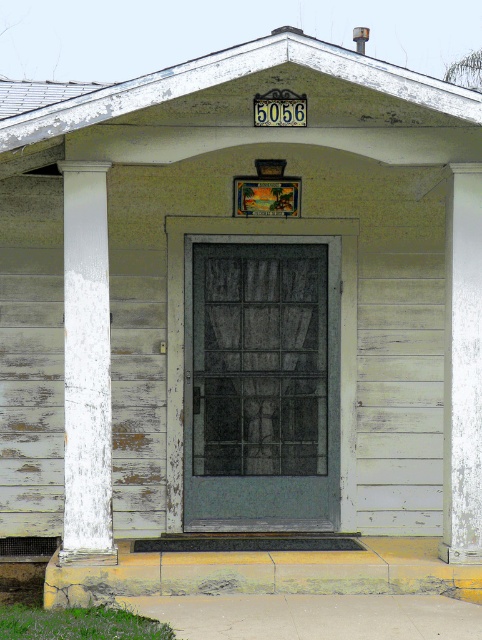
You are a painter hired to paint the columns and wood elements at the front of the house. You have a ladder that can reach up to 2 meters. The white painted wood column at left and white painted wood at center are both within your ladder reach. Which object requires more effort to paint due to its size?

The white painted wood column at left requires more effort to paint because its width is larger than the white painted wood at center.

You are standing at the front entrance of the house and want to know how far the point at coordinates (105, 193) is from your current position. Can you determine the distance?

The point at coordinates (105, 193) is 8.31 meters away from the camera, so it is 8.31 meters away from your current position.